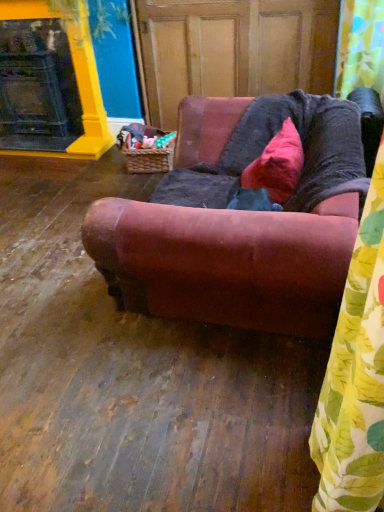
Question: Relative to wooden screen door at center, is yellow floral fabric shower curtain at upper right in front or behind?

Choices:
 (A) behind
 (B) front

Answer: (B)

Question: Looking at their shapes, would you say yellow floral fabric shower curtain at upper right is wider or thinner than wooden screen door at center?

Choices:
 (A) thin
 (B) wide

Answer: (A)

Question: Which of these objects is positioned closest to the pink velvet pillow at upper center?

Choices:
 (A) wooden screen door at center
 (B) woven brown basket at lower left
 (C) velvet brown couch at center
 (D) yellow floral fabric shower curtain at upper right
 (E) matte yellow fireplace at upper left

Answer: (C)

Question: Estimate the real-world distances between objects in this image. Which object is closer to the pink velvet pillow at upper center?

Choices:
 (A) woven brown basket at lower left
 (B) yellow floral fabric shower curtain at upper right
 (C) wooden screen door at center
 (D) velvet brown couch at center
 (E) matte yellow fireplace at upper left

Answer: (D)